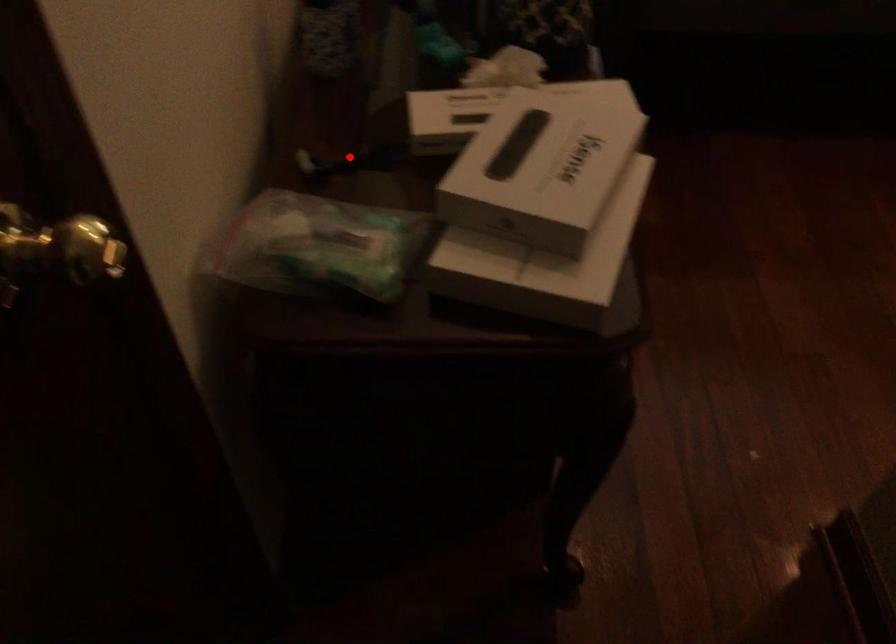
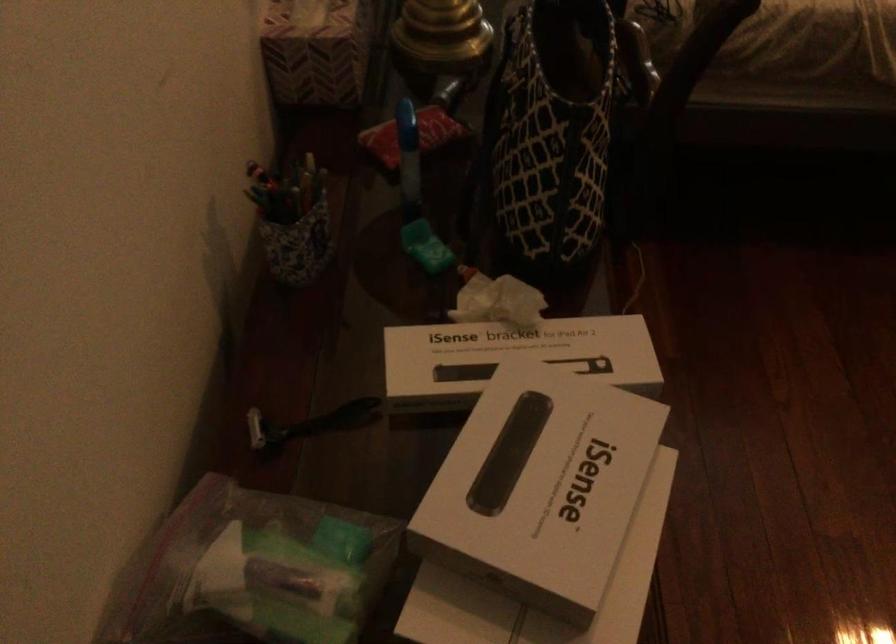
Locate, in the second image, the point that corresponds to the highlighted location in the first image.

(309, 422)